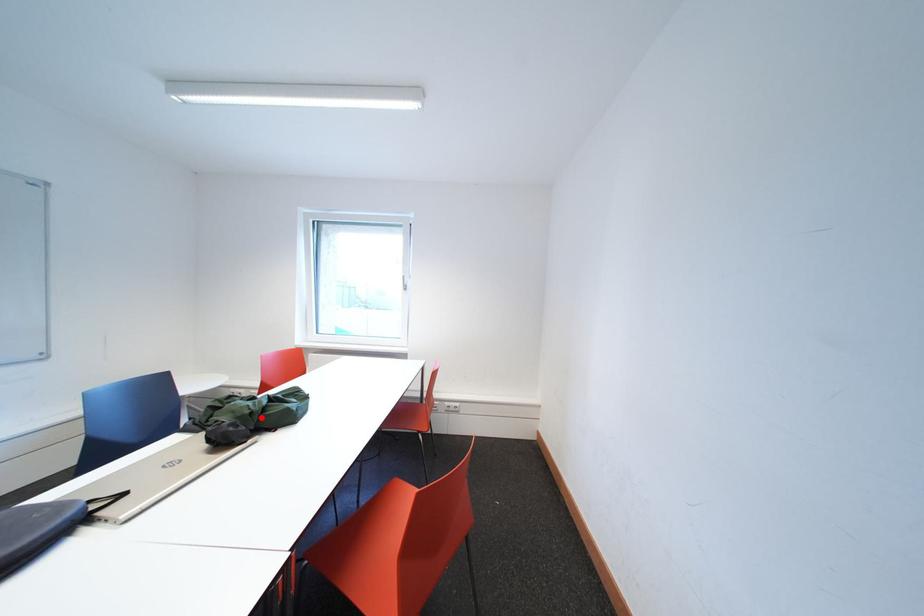
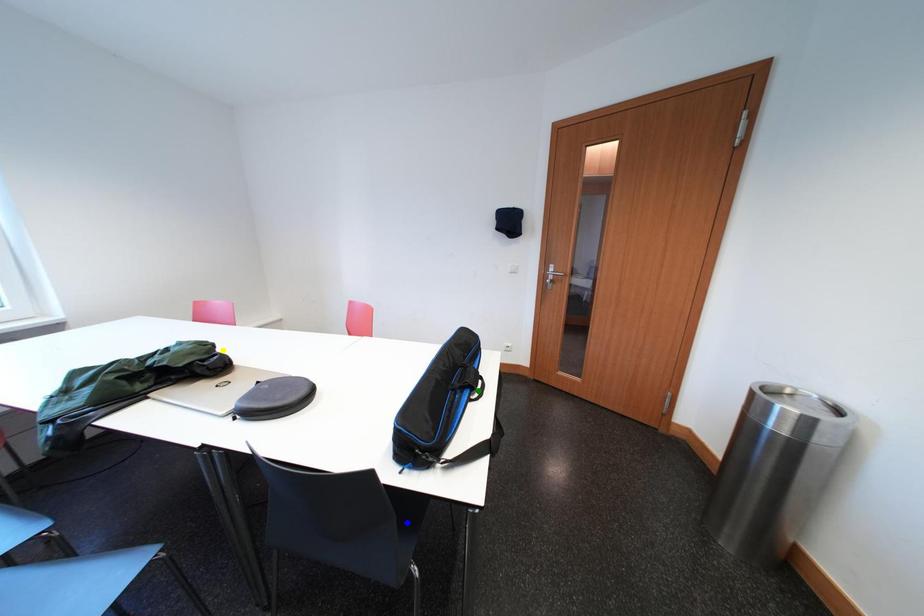
Question: I am providing you with two images of the same scene from different viewpoints. A red point is marked on the first image. You are given multiple points on the second image. Which spot in image 2 lines up with the point in image 1?

Choices:
 (A) yellow point
 (B) blue point
 (C) green point

Answer: (A)